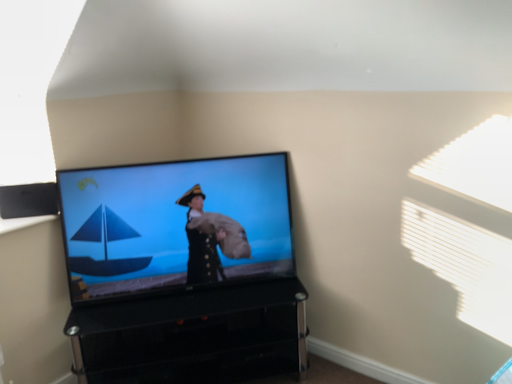
Question: Is black glossy tv stand at lower center outside black plastic speaker at upper left?

Choices:
 (A) no
 (B) yes

Answer: (B)

Question: Does black glossy tv stand at lower center have a lesser width compared to black plastic speaker at upper left?

Choices:
 (A) yes
 (B) no

Answer: (B)

Question: Is black glossy tv stand at lower center at the left side of black plastic speaker at upper left?

Choices:
 (A) yes
 (B) no

Answer: (B)

Question: Is black glossy tv stand at lower center surrounding black plastic speaker at upper left?

Choices:
 (A) no
 (B) yes

Answer: (A)

Question: From the image's perspective, is black glossy tv stand at lower center on top of black plastic speaker at upper left?

Choices:
 (A) yes
 (B) no

Answer: (B)

Question: Considering the positions of point (189, 322) and point (103, 269), is point (189, 322) closer or farther from the camera than point (103, 269)?

Choices:
 (A) farther
 (B) closer

Answer: (A)

Question: From a real-world perspective, is black glossy tv stand at lower center positioned above or below matte black tv at center?

Choices:
 (A) above
 (B) below

Answer: (B)

Question: Is black glossy tv stand at lower center in front of or behind matte black tv at center in the image?

Choices:
 (A) front
 (B) behind

Answer: (A)

Question: Considering the positions of black glossy tv stand at lower center and matte black tv at center in the image, is black glossy tv stand at lower center bigger or smaller than matte black tv at center?

Choices:
 (A) small
 (B) big

Answer: (B)

Question: Considering the positions of black plastic speaker at upper left and matte black tv at center in the image, is black plastic speaker at upper left wider or thinner than matte black tv at center?

Choices:
 (A) wide
 (B) thin

Answer: (B)

Question: Is point (20, 198) positioned closer to the camera than point (103, 168)?

Choices:
 (A) farther
 (B) closer

Answer: (B)

Question: Is black plastic speaker at upper left situated inside matte black tv at center or outside?

Choices:
 (A) inside
 (B) outside

Answer: (B)

Question: From the image's perspective, is black plastic speaker at upper left above or below matte black tv at center?

Choices:
 (A) above
 (B) below

Answer: (A)

Question: Visually, is black plastic speaker at upper left positioned to the left or to the right of black glossy tv stand at lower center?

Choices:
 (A) right
 (B) left

Answer: (B)

Question: Is black plastic speaker at upper left inside or outside of black glossy tv stand at lower center?

Choices:
 (A) outside
 (B) inside

Answer: (A)